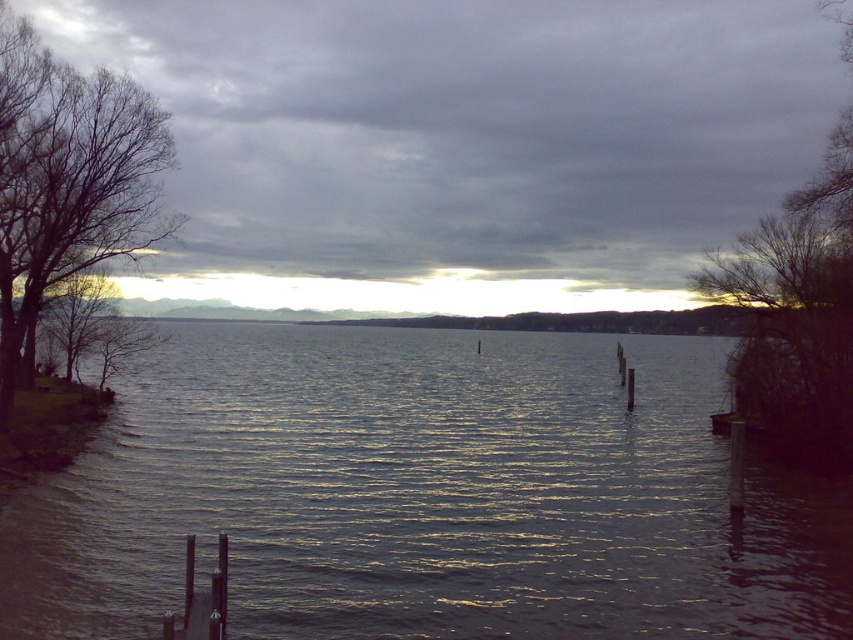
You are standing on the smooth wood dock at lower left and looking up at the gray cloudy sky at upper center. Which one has a greater width from your perspective?

The gray cloudy sky at upper center has a greater width than the smooth wood dock at lower left from your perspective.

You are standing at the lakeside and see two points marked in the image. The first point is at coordinates point (125, 122) and the second is at point (827, 349). Which point is closer to you?

Point (125, 122) is closer to you because it is further to the viewer than point (827, 349).

You are standing at the center of the image and want to walk towards the shiny blue water at center. In which direction should you move?

You should move forward because the shiny blue water at center is located directly in front of you at point (426, 497).